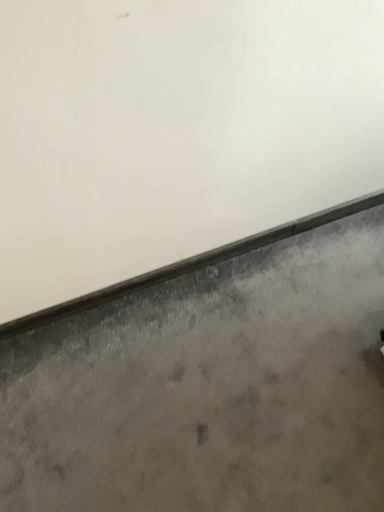
Question: Is gray concrete window sill at lower center next to gray concrete at bottom and touching it?

Choices:
 (A) no
 (B) yes

Answer: (A)

Question: Can you confirm if gray concrete window sill at lower center is positioned to the right of gray concrete at bottom?

Choices:
 (A) yes
 (B) no

Answer: (B)

Question: Is gray concrete window sill at lower center smaller than gray concrete at bottom?

Choices:
 (A) no
 (B) yes

Answer: (B)

Question: From the image's perspective, is gray concrete window sill at lower center over gray concrete at bottom?

Choices:
 (A) yes
 (B) no

Answer: (A)

Question: From a real-world perspective, is gray concrete window sill at lower center physically below gray concrete at bottom?

Choices:
 (A) yes
 (B) no

Answer: (B)

Question: Considering the relative sizes of gray concrete window sill at lower center and gray concrete at bottom in the image provided, is gray concrete window sill at lower center bigger than gray concrete at bottom?

Choices:
 (A) no
 (B) yes

Answer: (A)

Question: Can you confirm if gray concrete at bottom is bigger than gray concrete window sill at lower center?

Choices:
 (A) no
 (B) yes

Answer: (B)

Question: From a real-world perspective, does gray concrete at bottom sit lower than gray concrete window sill at lower center?

Choices:
 (A) yes
 (B) no

Answer: (A)

Question: Considering the relative sizes of gray concrete at bottom and gray concrete window sill at lower center in the image provided, is gray concrete at bottom wider than gray concrete window sill at lower center?

Choices:
 (A) yes
 (B) no

Answer: (A)

Question: Does gray concrete at bottom have a smaller size compared to gray concrete window sill at lower center?

Choices:
 (A) no
 (B) yes

Answer: (A)

Question: Is gray concrete at bottom aimed at gray concrete window sill at lower center?

Choices:
 (A) yes
 (B) no

Answer: (B)

Question: Is gray concrete at bottom at the left side of gray concrete window sill at lower center?

Choices:
 (A) yes
 (B) no

Answer: (B)

Question: From the image's perspective, is gray concrete at bottom above or below gray concrete window sill at lower center?

Choices:
 (A) above
 (B) below

Answer: (B)